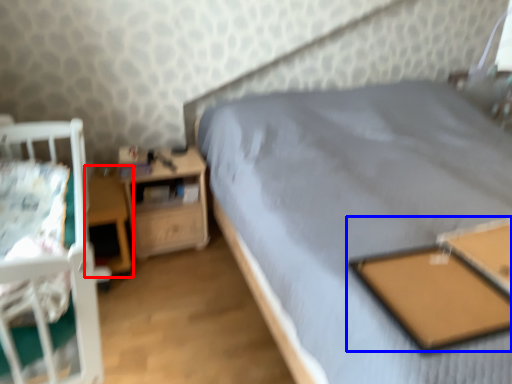
Question: Which of the following is the farthest to the observer, table (highlighted by a red box) or table (highlighted by a blue box)?

Choices:
 (A) table
 (B) table

Answer: (A)